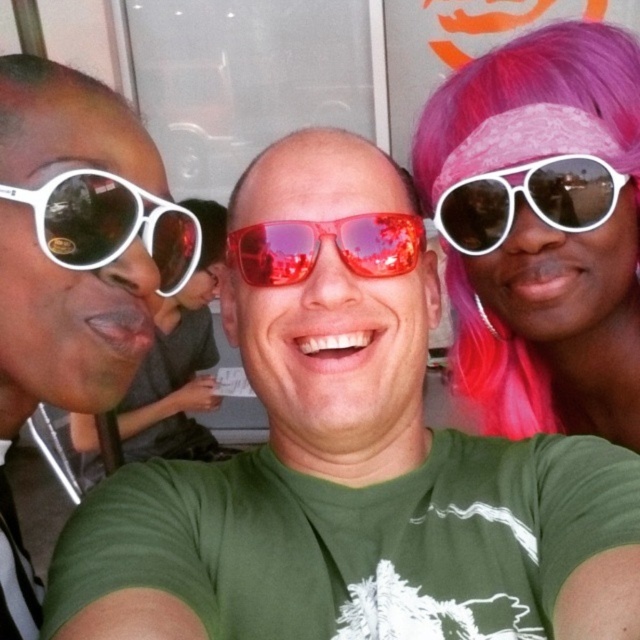
Question: Is pink fabric bandana at upper right bigger than red reflective sunglasses at center?

Choices:
 (A) no
 (B) yes

Answer: (B)

Question: Estimate the real-world distances between objects in this image. Which object is farther from the pink fabric bandana at upper right?

Choices:
 (A) white matte sunglasses at right
 (B) matte white sunglasses at left
 (C) white matte sunglasses at left

Answer: (B)

Question: Estimate the real-world distances between objects in this image. Which object is farther from the white matte sunglasses at left?

Choices:
 (A) white matte sunglasses at right
 (B) pink fabric bandana at upper right
 (C) matte white sunglasses at left
 (D) red reflective sunglasses at center

Answer: (B)

Question: Is pink fabric bandana at upper right thinner than matte white sunglasses at left?

Choices:
 (A) no
 (B) yes

Answer: (A)

Question: Can you confirm if matte white sunglasses at left is smaller than white matte sunglasses at right?

Choices:
 (A) yes
 (B) no

Answer: (B)

Question: Which of these objects is positioned closest to the pink fabric bandana at upper right?

Choices:
 (A) matte white sunglasses at left
 (B) white matte sunglasses at right
 (C) white matte sunglasses at left

Answer: (B)